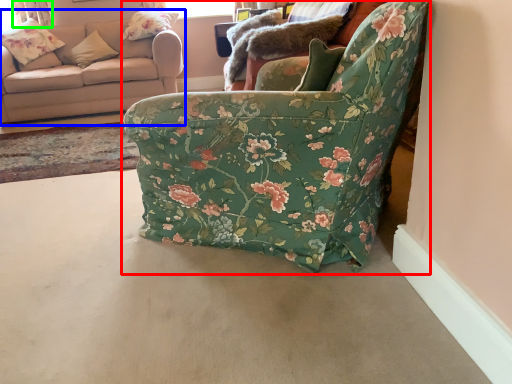
Question: Based on their relative distances, which object is nearer to chair (highlighted by a red box)? Choose from studio couch (highlighted by a blue box) and curtain (highlighted by a green box).

Choices:
 (A) studio couch
 (B) curtain

Answer: (A)